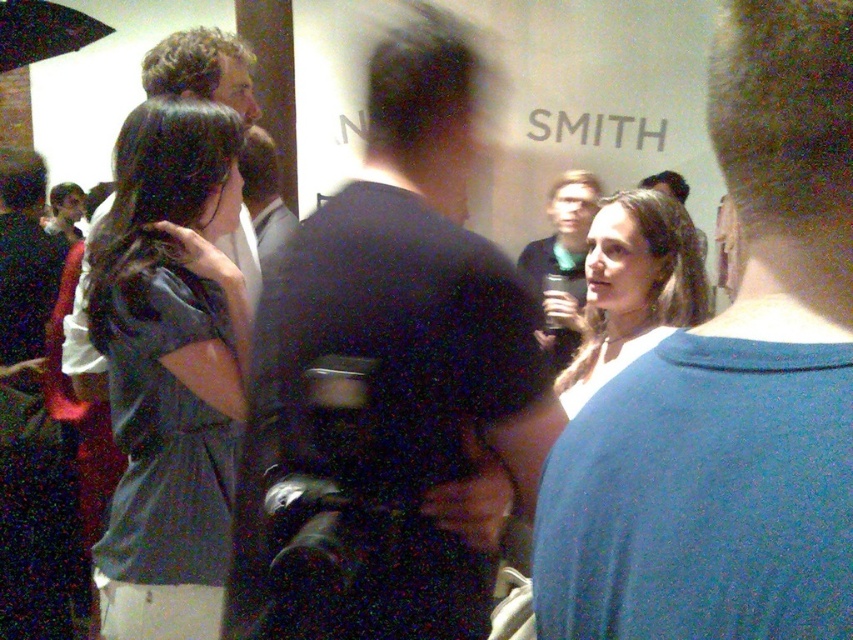
Which is above, black leather jacket at center or matte black jacket at center?

matte black jacket at center is higher up.

Is point (502, 269) in front of point (525, 266)?

Yes, point (502, 269) is closer to viewer.

Between point (340, 356) and point (578, 236), which one is positioned behind?

Positioned behind is point (578, 236).

At what (x,y) coordinates should I click in order to perform the action: click on black leather jacket at center. Please return your answer as a coordinate pair (x, y). This screenshot has width=853, height=640. Looking at the image, I should click on (386, 378).

Which is behind, point (190, 317) or point (244, 141)?

The point (244, 141) is more distant.

Find the location of `matte gray shirt at left`. matte gray shirt at left is located at coordinates (170, 365).

Is point (184, 209) farther from camera compared to point (294, 216)?

No, (184, 209) is closer to viewer.

This screenshot has width=853, height=640. What are the coordinates of `matte gray shirt at left` in the screenshot? It's located at (170, 365).

Is point (656, 276) farther from viewer compared to point (576, 227)?

No, (656, 276) is in front of (576, 227).

Is matte blue shirt at center in front of matte black jacket at center?

Yes, it is.

Describe the element at coordinates (633, 288) in the screenshot. The width and height of the screenshot is (853, 640). I see `matte blue shirt at center` at that location.

Identify the location of matte blue shirt at center. The image size is (853, 640). (633, 288).